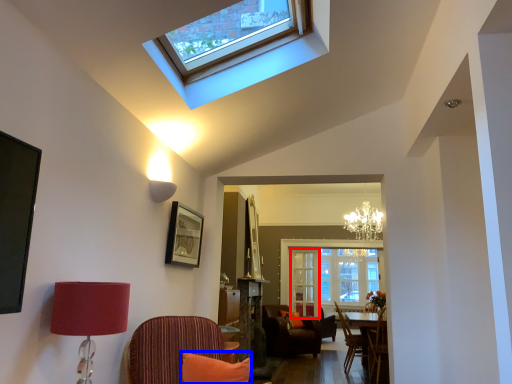
Question: Which point is closer to the camera, glass door (highlighted by a red box) or pillow (highlighted by a blue box)?

Choices:
 (A) glass door
 (B) pillow

Answer: (B)